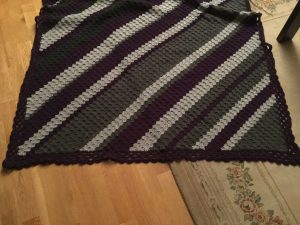
Find the location of `area rug`. area rug is located at coordinates (289, 181).